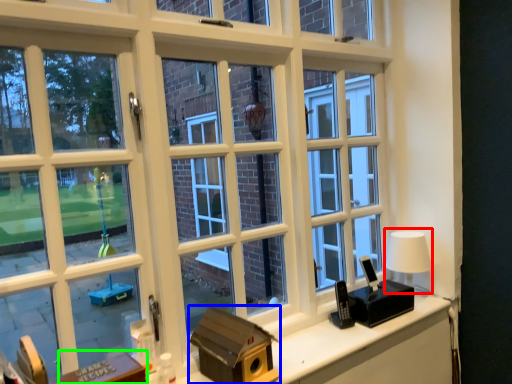
Question: Considering the real-world distances, which object is farthest from table lamp (highlighted by a red box)? box (highlighted by a blue box) or table (highlighted by a green box)?

Choices:
 (A) box
 (B) table

Answer: (B)